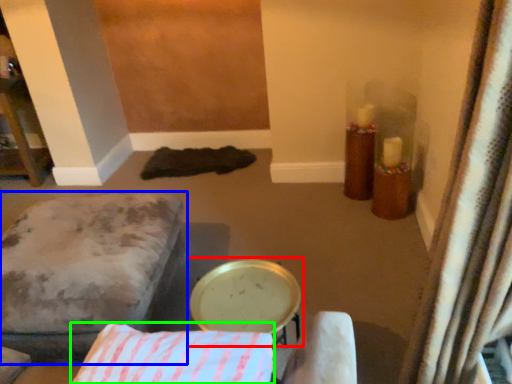
Question: Which is farther away from round table (highlighted by a red box)? furniture (highlighted by a blue box) or pillow (highlighted by a green box)?

Choices:
 (A) furniture
 (B) pillow

Answer: (A)